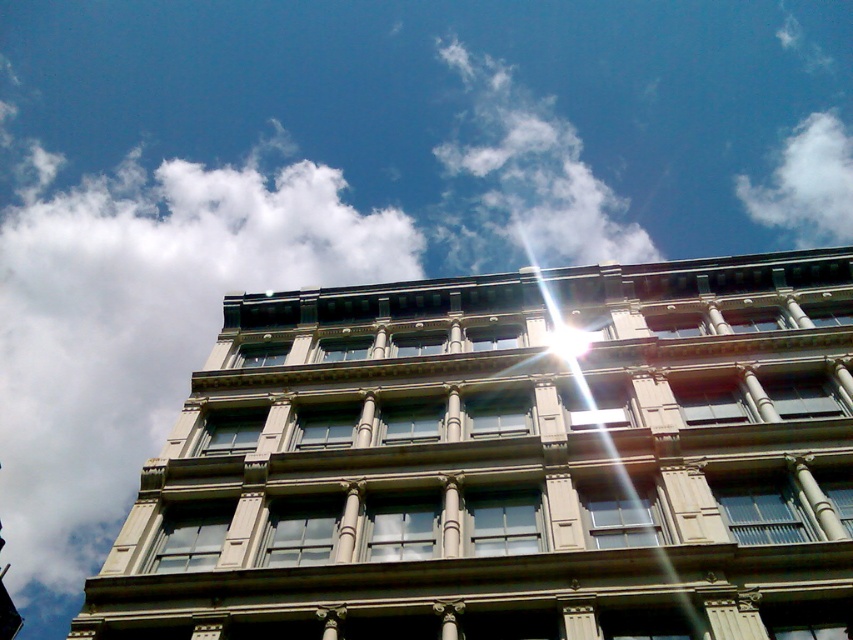
Question: Is white fluffy cloud at upper center behind white fluffy cloud at upper right?

Choices:
 (A) no
 (B) yes

Answer: (A)

Question: Does white fluffy cloud at upper center have a lesser width compared to white fluffy cloud at upper right?

Choices:
 (A) yes
 (B) no

Answer: (B)

Question: Among these points, which one is nearest to the camera?

Choices:
 (A) (810, 236)
 (B) (201, 177)
 (C) (483, 120)

Answer: (C)

Question: Which of the following is the farthest from the observer?

Choices:
 (A) white fluffy cloud at upper center
 (B) white fluffy cloud at upper left
 (C) white fluffy cloud at upper right

Answer: (C)

Question: Which point appears closest to the camera in this image?

Choices:
 (A) (6, 257)
 (B) (846, 218)

Answer: (B)

Question: Is white fluffy cloud at upper left positioned before white fluffy cloud at upper right?

Choices:
 (A) no
 (B) yes

Answer: (B)